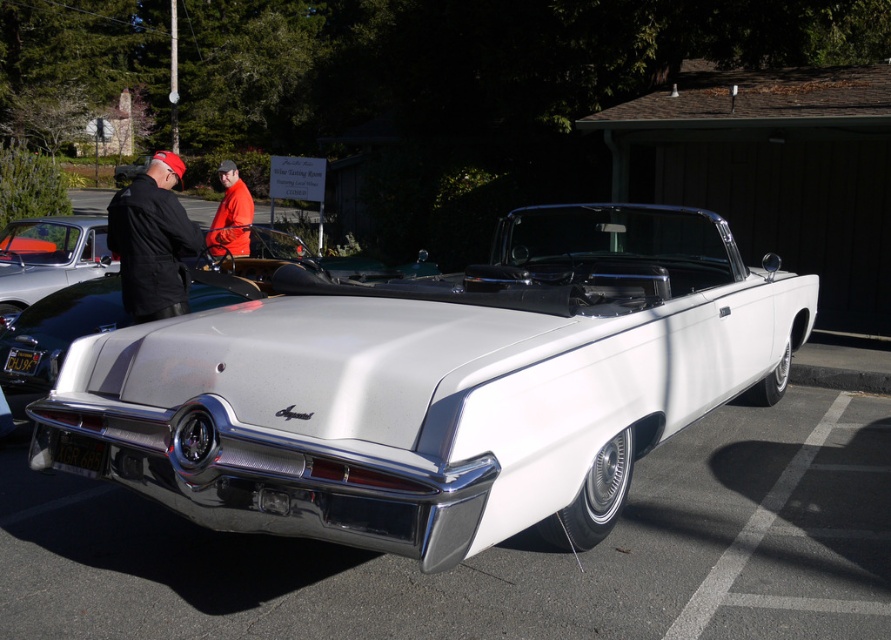
Question: Which of the following is the closest to the observer?

Choices:
 (A) orange fabric jacket at center
 (B) shiny silver car at center

Answer: (A)

Question: Observing the image, what is the correct spatial positioning of shiny silver car at center in reference to orange fabric jacket at center?

Choices:
 (A) below
 (B) above

Answer: (A)

Question: Among these objects, which one is farthest from the camera?

Choices:
 (A) shiny silver car at center
 (B) white glossy car at center

Answer: (A)

Question: Which of the following is the closest to the observer?

Choices:
 (A) orange fabric jacket at center
 (B) black leather jacket at left
 (C) white glossy car at center
 (D) shiny silver car at center

Answer: (C)

Question: Can you confirm if white glossy car at center is wider than black leather jacket at left?

Choices:
 (A) yes
 (B) no

Answer: (A)

Question: Is shiny silver car at center further to the viewer compared to orange fabric jacket at center?

Choices:
 (A) no
 (B) yes

Answer: (B)